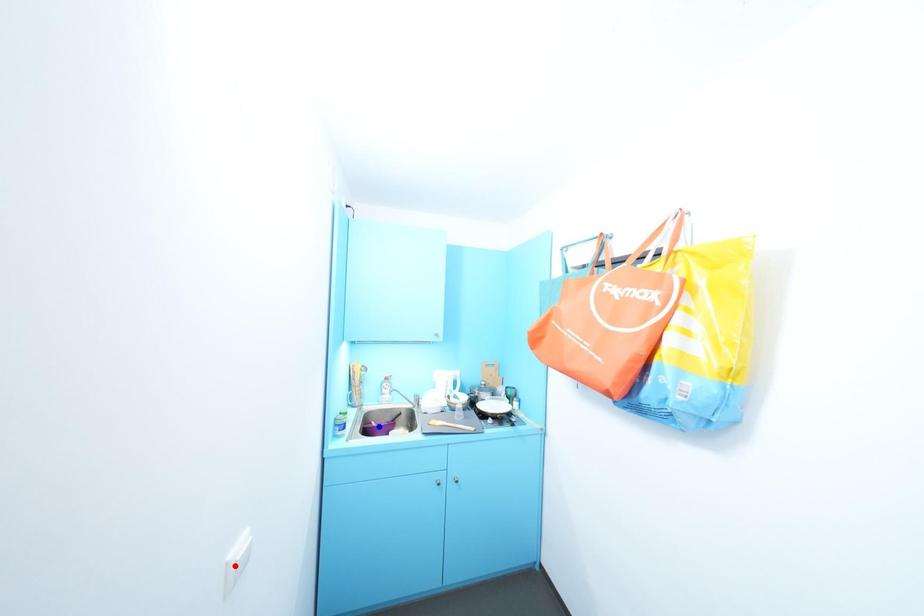
Question: Which of the two points in the image is closer to the camera?

Choices:
 (A) Blue point is closer.
 (B) Red point is closer.

Answer: (B)